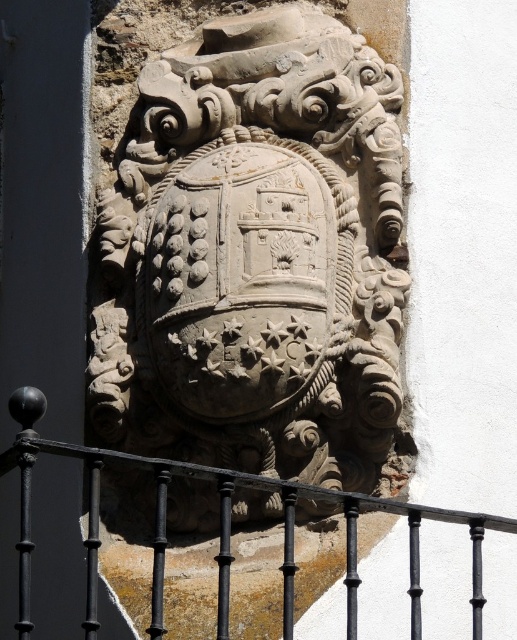
Can you confirm if carved stone shield at center is positioned above black wrought iron at center?

Correct, carved stone shield at center is located above black wrought iron at center.

Is carved stone shield at center closer to camera compared to black wrought iron at center?

Result: No, carved stone shield at center is further to the viewer.

The width and height of the screenshot is (517, 640). What do you see at coordinates (254, 256) in the screenshot?
I see `carved stone shield at center` at bounding box center [254, 256].

I want to click on carved stone shield at center, so click(254, 256).